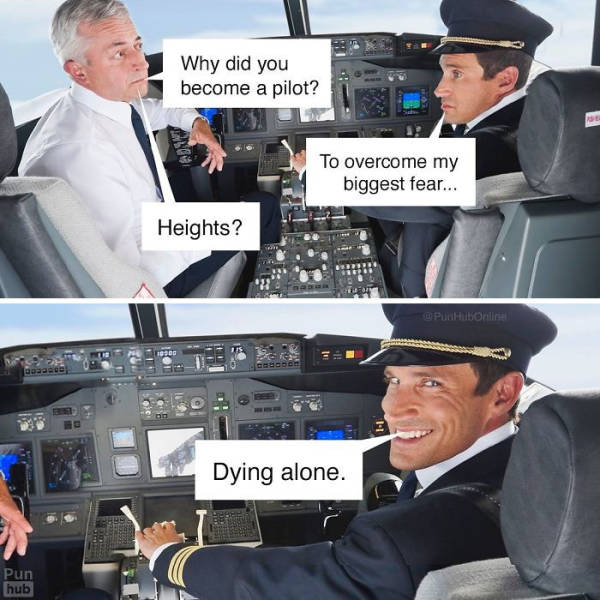
You are a GUI agent. You are given a task and a screenshot of the screen. Output one action in this format:
    pyautogui.click(x=<x>, y=<y>)
    Task: Click on the light gray top of seat
    The image size is (600, 600).
    Given the screenshot: What is the action you would take?
    pyautogui.click(x=477, y=579)